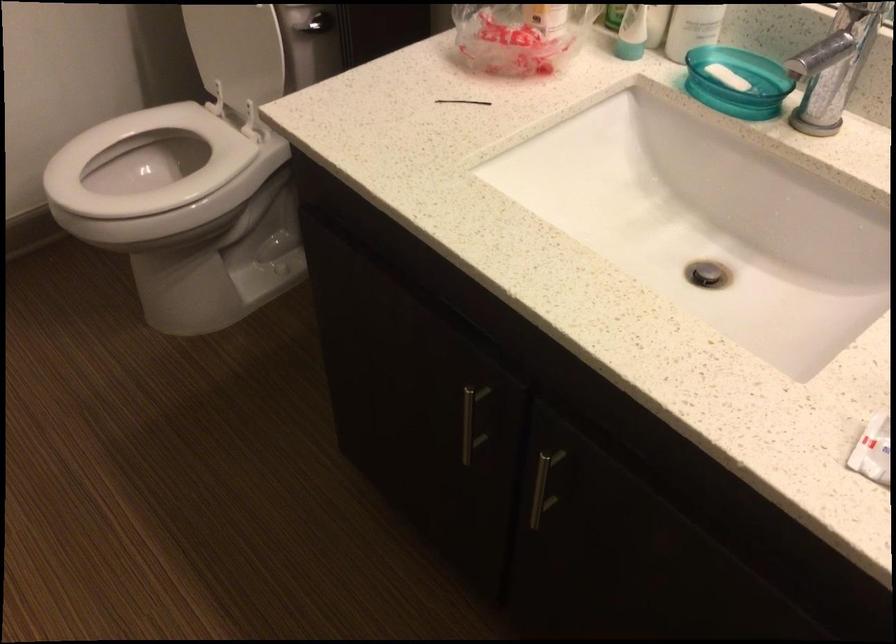
The image size is (896, 644). I want to click on faucet handle, so click(830, 75).